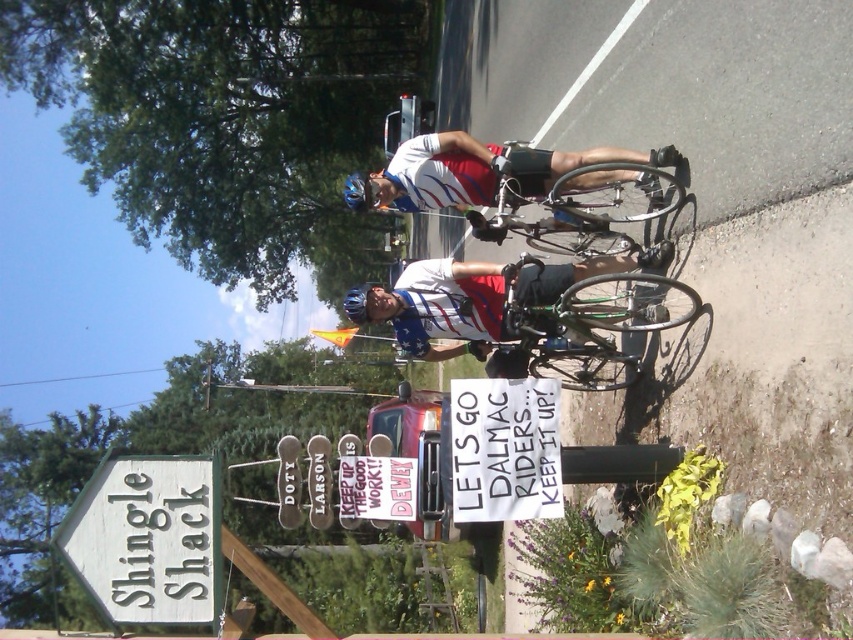
Can you confirm if white wooden sign at lower left is bigger than matte white and blue cycling jersey at center?

Actually, white wooden sign at lower left might be smaller than matte white and blue cycling jersey at center.

Which is behind, point (196, 579) or point (488, 182)?

The point (488, 182) is more distant.

Locate an element on the screen. This screenshot has height=640, width=853. white wooden sign at lower left is located at coordinates 148,538.

The image size is (853, 640). I want to click on matte white helmet at center, so click(x=480, y=298).

Who is more distant from viewer, (434, 260) or (531, 518)?

Positioned behind is point (434, 260).

What do you see at coordinates (480, 298) in the screenshot? The height and width of the screenshot is (640, 853). I see `matte white helmet at center` at bounding box center [480, 298].

This screenshot has width=853, height=640. In order to click on matte white helmet at center in this screenshot , I will do `click(480, 298)`.

In the scene shown: Is white paper sign at center closer to camera compared to matte blue helmet at center?

That is True.

Does point (474, 408) come closer to viewer compared to point (357, 310)?

Yes, it is.

Locate an element on the screen. This screenshot has width=853, height=640. white paper sign at center is located at coordinates [505, 449].